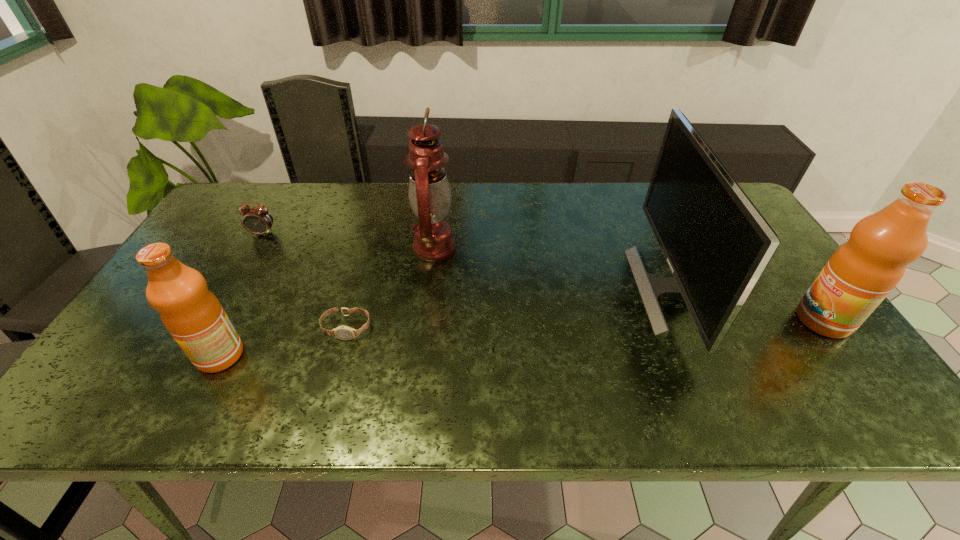
Please point a space for a new fruit_juice to maintain equal intervals. Please provide its 2D coordinates. Your answer should be formatted as a tuple, i.e. [(x, y)], where the tuple contains the x and y coordinates of a point satisfying the conditions above.

[(533, 337)]